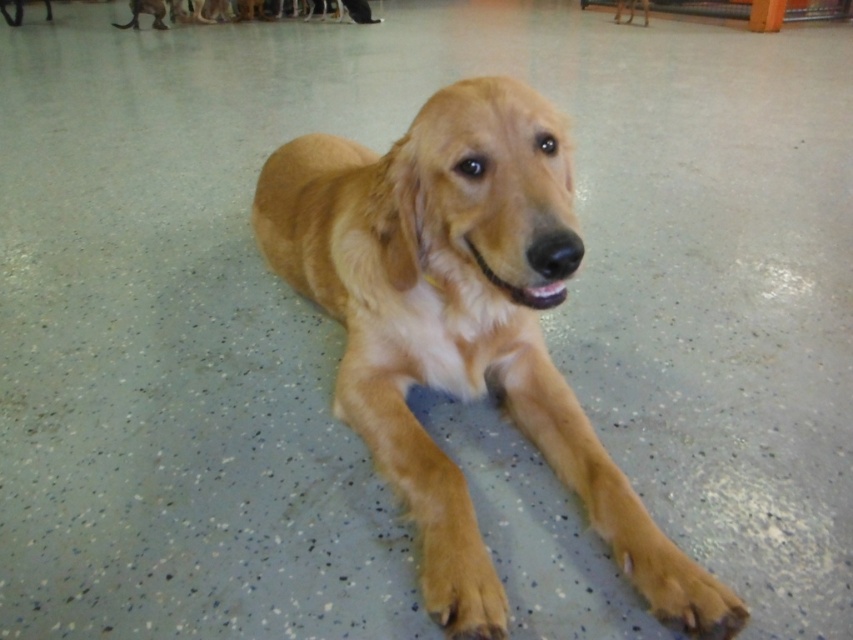
You are standing at the position of the golden retriever in the image. There are two points marked on the floor. The first point is at coordinate point (555,268), and the second point is at coordinate point (477,596). If you want to walk towards the point that is closer to you, which coordinate should you head towards?

The point at coordinate point (555,268) is closer to you because it is in front of point (477,596).

Based on the scene description, where is the golden fur dog at center in relation to the golden fur paw at lower center?

The golden fur dog at center is to the left of the golden fur paw at lower center.

You are a photographer trying to capture the golden fur dog at center and the golden fur paw at lower center in a single frame. Based on their positions, can you determine which one is closer to the camera?

The golden fur paw at lower center is closer to the camera because it is positioned below the golden fur dog at center, which is above it.